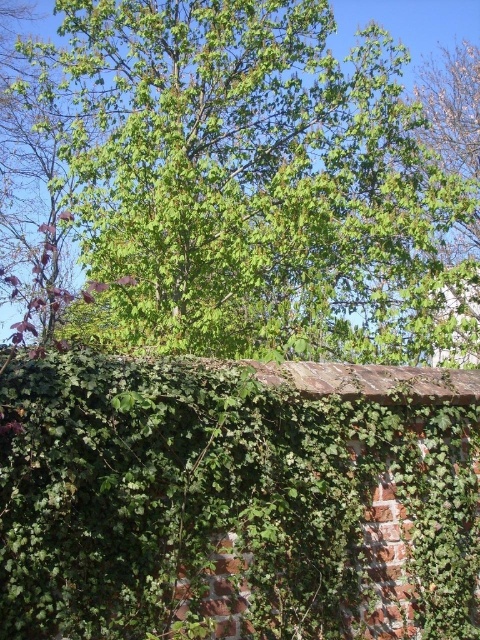
Question: Is green leafy tree at upper center bigger than green leafy hedge at upper center?

Choices:
 (A) yes
 (B) no

Answer: (A)

Question: Is green leafy tree at upper center closer to camera compared to green leafy hedge at upper center?

Choices:
 (A) yes
 (B) no

Answer: (B)

Question: Can you confirm if green leafy tree at upper center is positioned to the right of green leafy hedge at upper center?

Choices:
 (A) no
 (B) yes

Answer: (B)

Question: Among these objects, which one is farthest from the camera?

Choices:
 (A) green leafy hedge at upper center
 (B) green leafy tree at upper center

Answer: (B)

Question: Which point is farther to the camera?

Choices:
 (A) green leafy tree at upper center
 (B) green leafy hedge at upper center

Answer: (A)